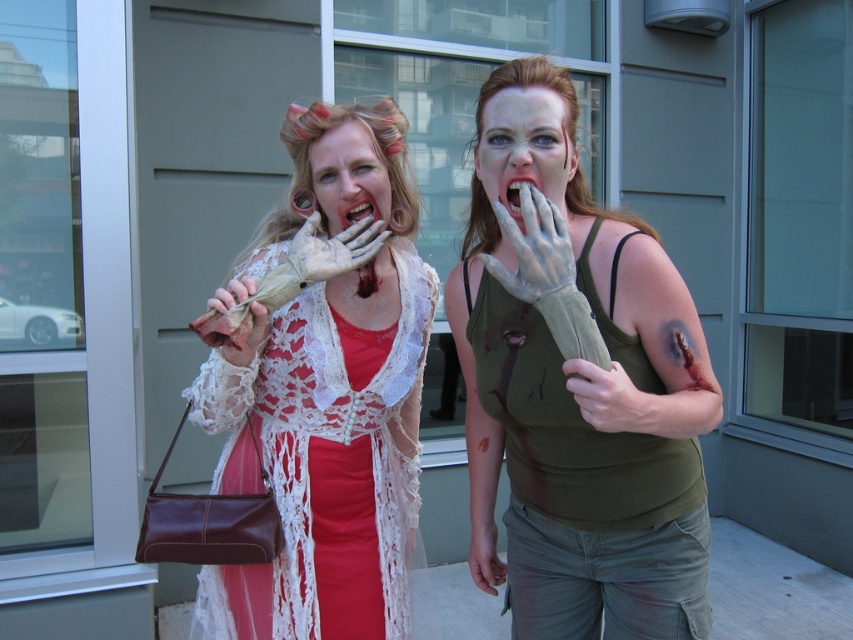
You are standing in front of the two costumed individuals. You want to move closer to the point that is closer to you. Which point should you move towards, point [476,157] or point [596,406]?

You should move towards point [476,157] because it is closer to you than point [596,406].

You are a photographer trying to capture a closeup shot of the matte green tank top at center and the matte white glove at center. Which one should you focus on first to ensure both are in focus?

The matte green tank top at center is closer to the viewer than the matte white glove at center, so you should focus on the matte green tank top at center first to ensure both are in focus.

You are a costume designer trying to decide which prop to use for a scene. You have the matte lace dress at center and the matte green glove at center. Which prop should you choose if you need something that can cover a larger area?

The matte lace dress at center is larger in size than the matte green glove at center, so you should choose the matte lace dress at center for covering a larger area.